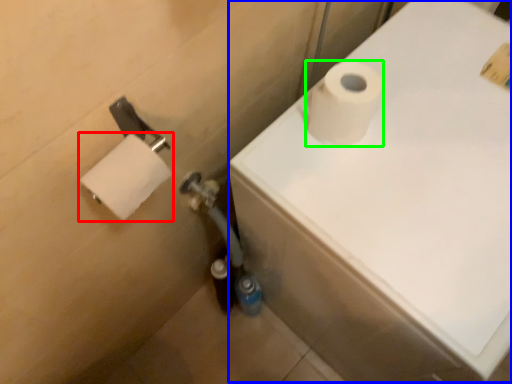
Question: Estimate the real-world distances between objects in this image. Which object is farther from toilet paper (highlighted by a red box), bath (highlighted by a blue box) or toilet paper (highlighted by a green box)?

Choices:
 (A) bath
 (B) toilet paper

Answer: (A)